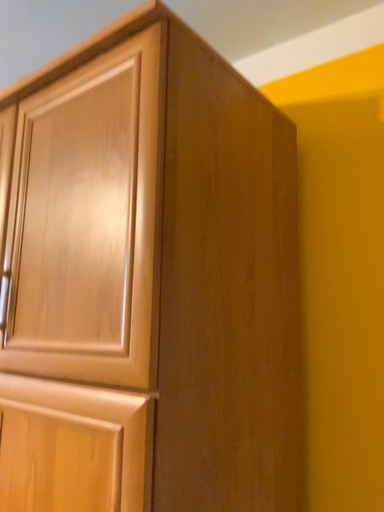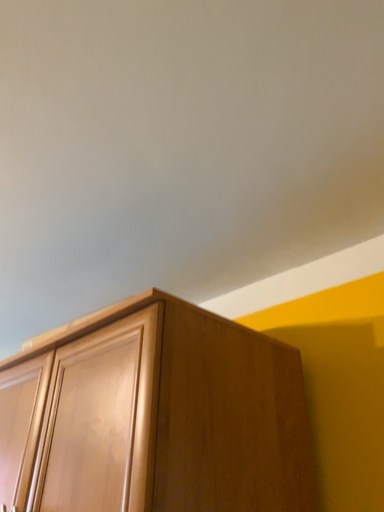
Question: How did the camera likely rotate when shooting the video?

Choices:
 (A) rotated left
 (B) rotated right

Answer: (A)